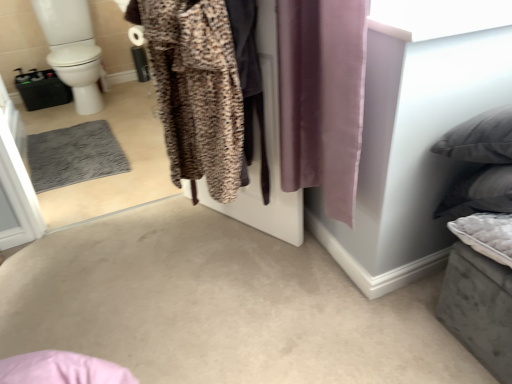
This screenshot has width=512, height=384. Find the location of `vacant location below purple silky curtain at center (from a real-world perspective)`. vacant location below purple silky curtain at center (from a real-world perspective) is located at coordinates (316, 266).